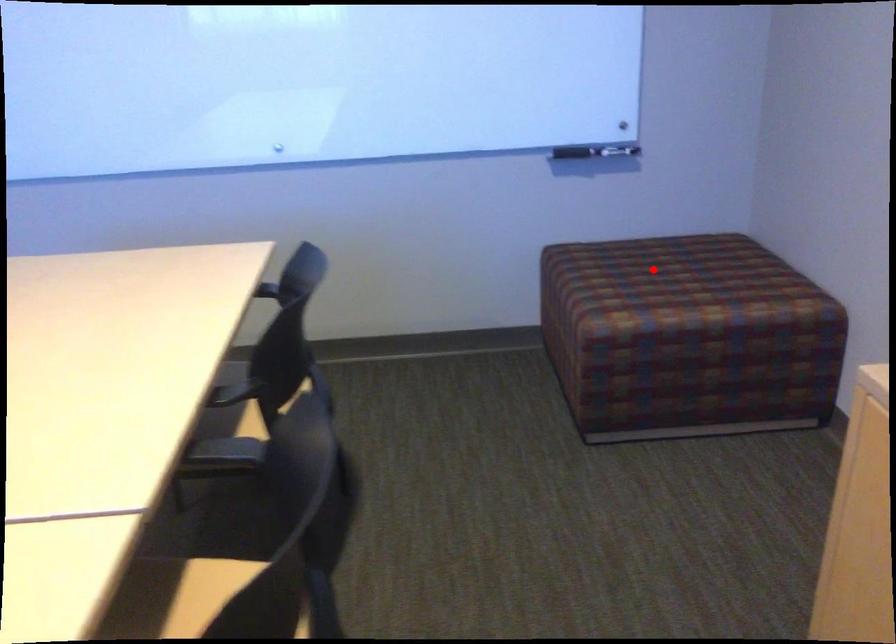
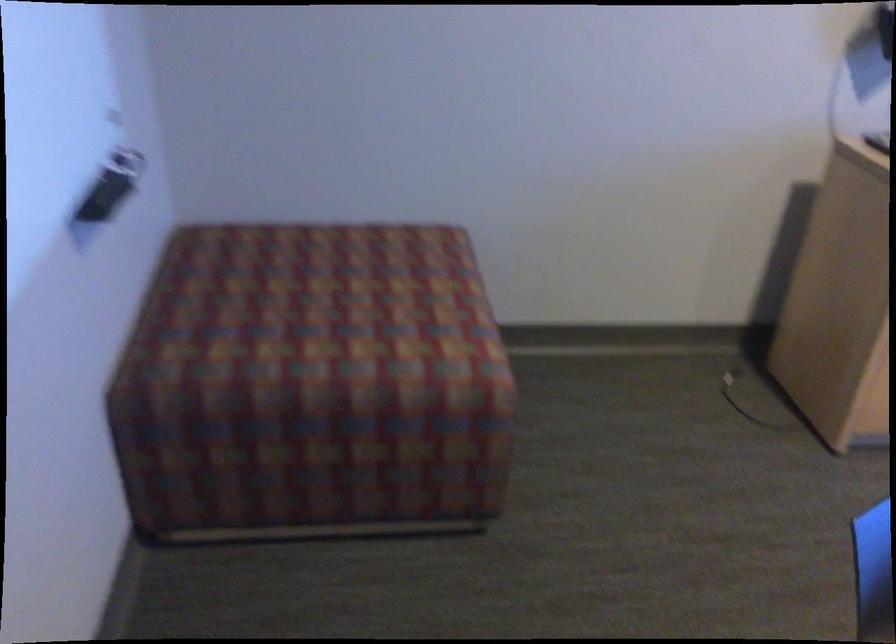
Question: I am providing you with two images of the same scene from different viewpoints. In image1, a red point is highlighted. Considering the same 3D point in image2, which of the following is correct?

Choices:
 (A) It is closer
 (B) It is farther

Answer: (A)